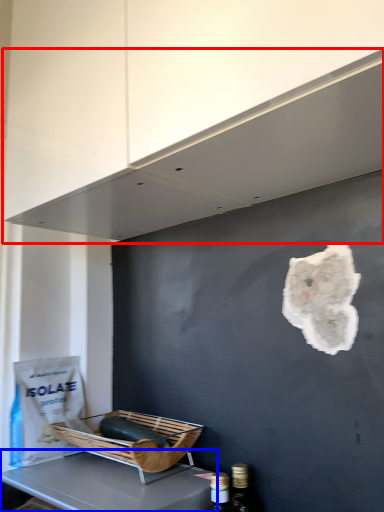
Question: Which object appears farthest to the camera in this image, exhaust hood (highlighted by a red box) or furniture (highlighted by a blue box)?

Choices:
 (A) exhaust hood
 (B) furniture

Answer: (B)